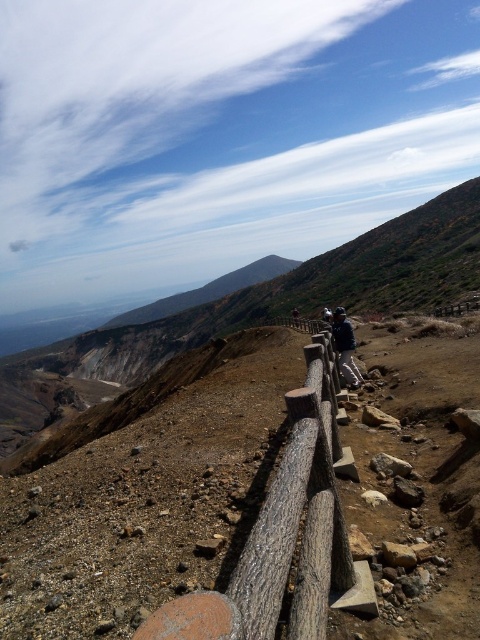
Question: Can you confirm if wooden log rail at center is wider than dark blue jacket at center?

Choices:
 (A) yes
 (B) no

Answer: (A)

Question: Among these objects, which one is farthest from the camera?

Choices:
 (A) wooden log rail at center
 (B) dark blue jacket at center

Answer: (B)

Question: Which object appears closest to the camera in this image?

Choices:
 (A) dark blue jacket at center
 (B) wooden log rail at center

Answer: (B)

Question: Is wooden log rail at center below dark blue jacket at center?

Choices:
 (A) no
 (B) yes

Answer: (B)

Question: Can you confirm if wooden log rail at center is positioned above dark blue jacket at center?

Choices:
 (A) yes
 (B) no

Answer: (B)

Question: Which object appears farthest from the camera in this image?

Choices:
 (A) dark blue jacket at center
 (B) wooden log rail at center

Answer: (A)